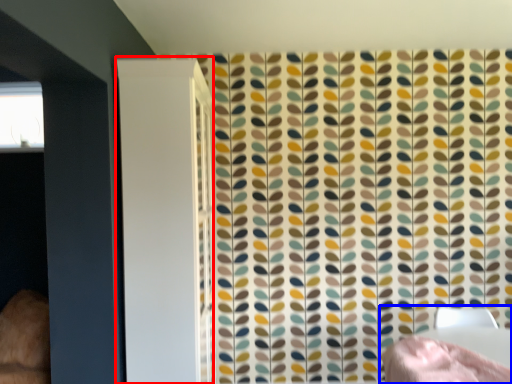
Question: Which of the following is the closest to the observer, screen door (highlighted by a red box) or bed (highlighted by a blue box)?

Choices:
 (A) screen door
 (B) bed

Answer: (B)